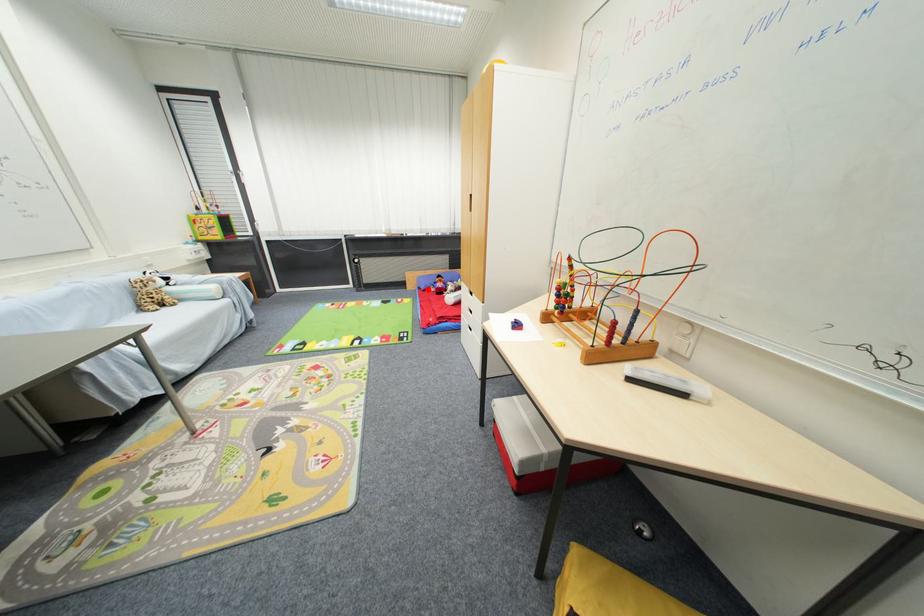
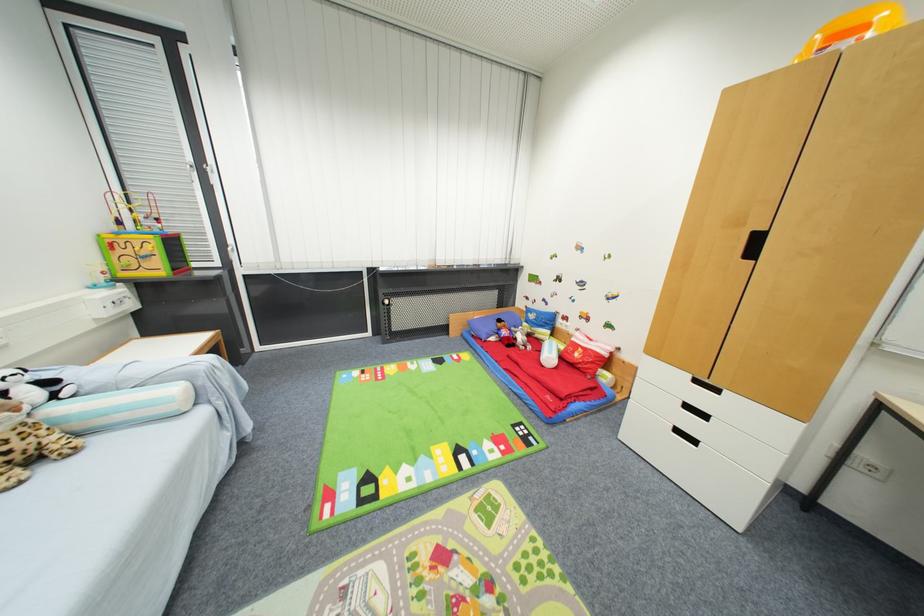
Find the pixel in the second image that matches the highlighted location in the first image.

(488, 339)